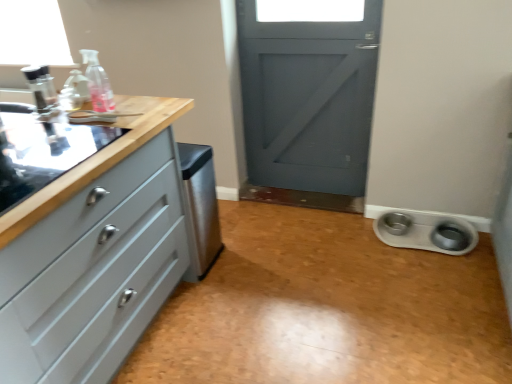
The image size is (512, 384). I want to click on unoccupied area in front of transparent plastic bottle at upper left, so click(x=88, y=127).